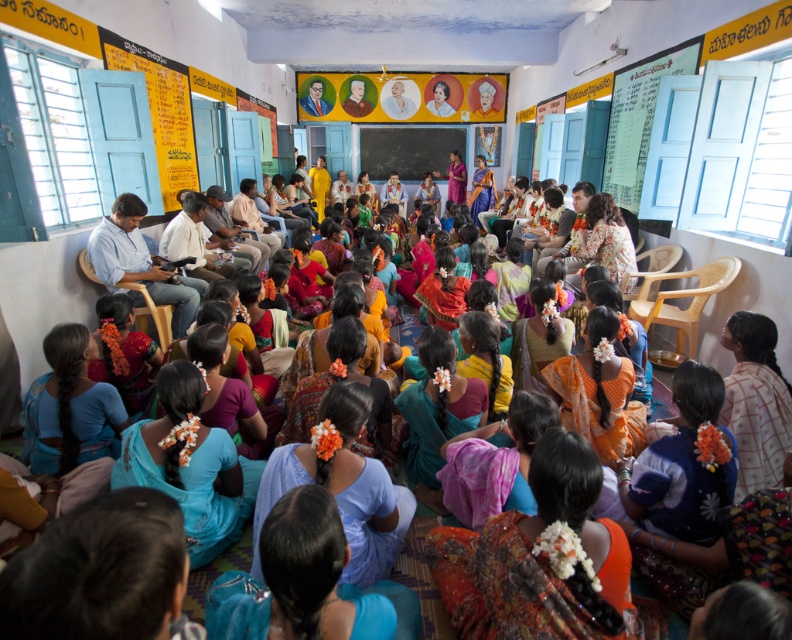
Does point (649, 120) come farther from viewer compared to point (126, 259)?

Yes, point (649, 120) is farther from viewer.

The height and width of the screenshot is (640, 792). In order to click on white paperboard at upper right in this screenshot , I will do (638, 116).

Where is `white paperboard at upper right`? Image resolution: width=792 pixels, height=640 pixels. white paperboard at upper right is located at coordinates (638, 116).

Does point (629, 72) come behind point (366, 170)?

No, it is not.

Between white paperboard at upper right and smooth wooden board at center, which one appears on the left side from the viewer's perspective?

smooth wooden board at center is more to the left.

Is point (626, 196) positioned before point (463, 147)?

That is True.

Where is `white paperboard at upper right`? The height and width of the screenshot is (640, 792). white paperboard at upper right is located at coordinates (638, 116).

What are the coordinates of `blue shirt at left` in the screenshot? It's located at (139, 262).